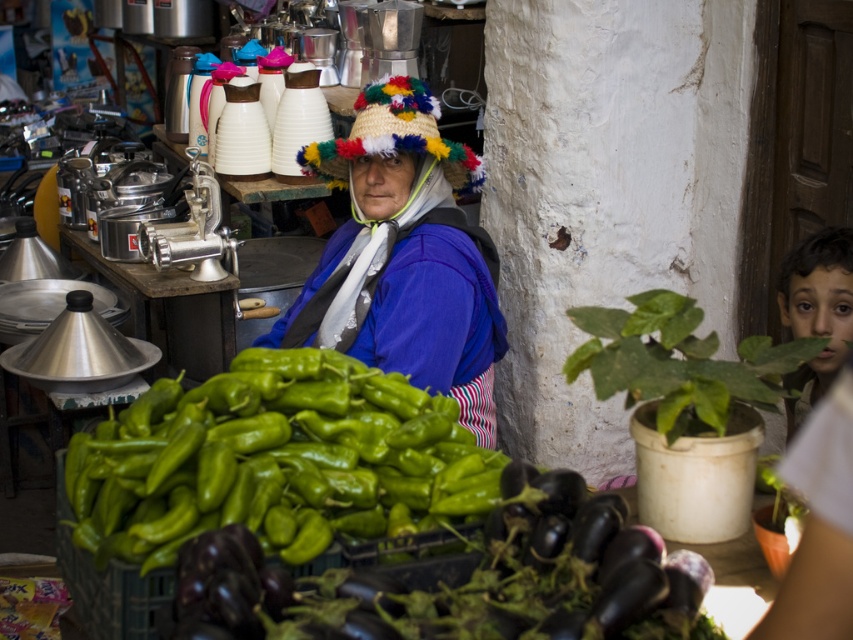
Is green matte peppers at lower left taller than brown hair at right?

No.

Is point (248, 385) farther from camera compared to point (848, 241)?

No.

I want to click on green matte peppers at lower left, so click(x=260, y=458).

Looking at this image, between green matte eggplant at center and brown hair at right, which one appears on the right side from the viewer's perspective?

brown hair at right is more to the right.

At what (x,y) coordinates should I click in order to perform the action: click on green matte eggplant at center. Please return your answer as a coordinate pair (x, y). The height and width of the screenshot is (640, 853). Looking at the image, I should click on (466, 582).

Is green matte peppers at lower left smaller than green matte eggplant at center?

Incorrect, green matte peppers at lower left is not smaller in size than green matte eggplant at center.

Where is `green matte peppers at lower left`? green matte peppers at lower left is located at coordinates (260, 458).